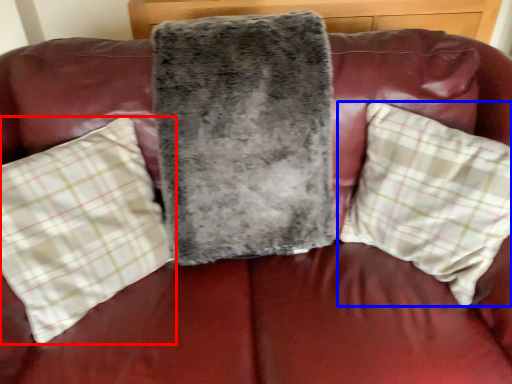
Question: Among these objects, which one is farthest to the camera, pillow (highlighted by a red box) or pillow (highlighted by a blue box)?

Choices:
 (A) pillow
 (B) pillow

Answer: (B)